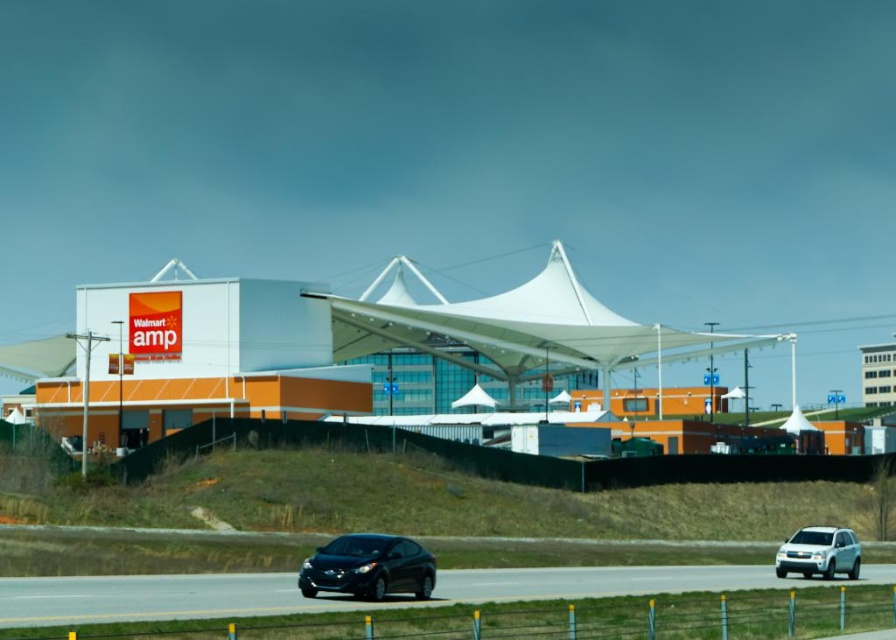
Between point (616, 595) and point (851, 576), which one is positioned behind?

The point (851, 576) is behind.

Can you confirm if black asphalt highway at lower center is bigger than white matte suv at lower right?

Yes.

Consider the image. Who is more distant from viewer, (x=76, y=579) or (x=831, y=541)?

Point (x=831, y=541)

Image resolution: width=896 pixels, height=640 pixels. I want to click on black asphalt highway at lower center, so click(x=156, y=596).

Is black asphalt highway at lower center shorter than glossy black car at lower center?

No.

Does black asphalt highway at lower center have a greater width compared to glossy black car at lower center?

Indeed, black asphalt highway at lower center has a greater width compared to glossy black car at lower center.

Who is more distant from viewer, (472,577) or (349,586)?

The point (472,577) is behind.

Find the location of a particular element. black asphalt highway at lower center is located at coordinates (156, 596).

Who is more distant from viewer, (334, 541) or (857, 545)?

The point (857, 545) is more distant.

Is point (375, 573) positioned in front of point (843, 536)?

Yes, point (375, 573) is closer to viewer.

Between point (314, 552) and point (808, 573), which one is positioned behind?

The point (314, 552) is behind.

Image resolution: width=896 pixels, height=640 pixels. I want to click on glossy black car at lower center, so coord(368,566).